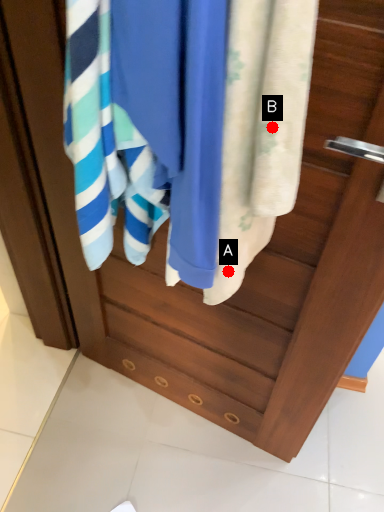
Question: Two points are circled on the image, labeled by A and B beside each circle. Which point is closer to the camera taking this photo?

Choices:
 (A) A is closer
 (B) B is closer

Answer: (B)